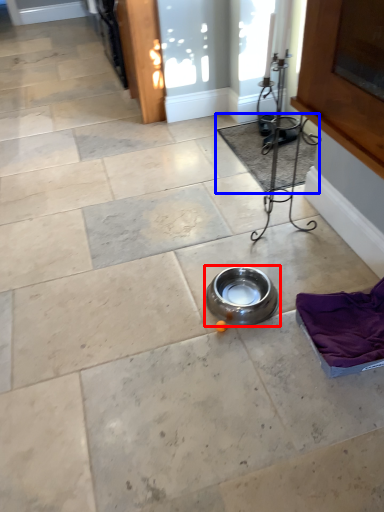
Question: Which of the following is the closest to the observer, bowl (highlighted by a red box) or mat (highlighted by a blue box)?

Choices:
 (A) bowl
 (B) mat

Answer: (A)